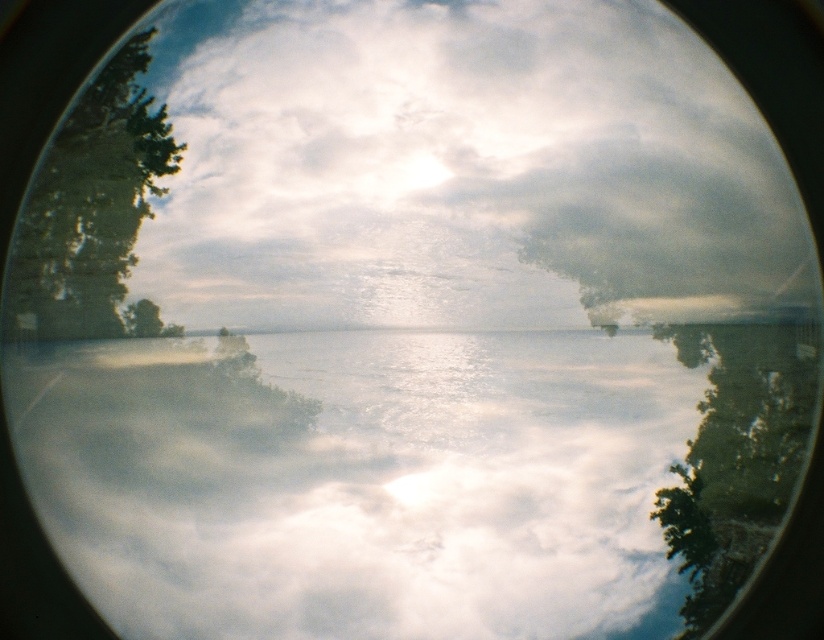
You are an observer looking through the circular window. You see the translucent glass water at center and the green leafy tree at left. Which object is closer to you?

The translucent glass water at center is closer to the viewer than the green leafy tree at left.

You are an astronomer analyzing the image. You notice the translucent glass water at center. Based on its position relative to the horizon line, is it above or below the horizon?

The translucent glass water at center is located at point (413,477), which is below the horizon line since the horizon divides the frame into two equal parts at the middle. Therefore, the water is positioned below the horizon.

You are an architect designing a new building and want to ensure the green leafy tree at left and cloudy sky at upper center are visible from the circular window. Given the window is 10 inches wide, will both fit within the window?

The distance between the cloudy sky at upper center and green leafy tree at left is 8.72 inches, which is less than the window width of 10 inches. Therefore, both will fit within the window.